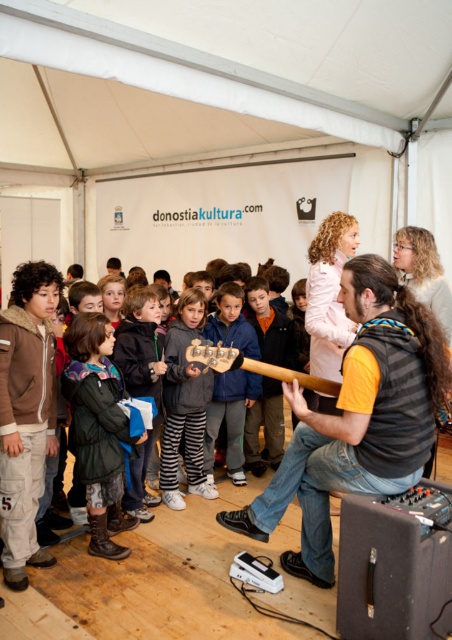
Question: Can you confirm if blue fabric jacket at center is positioned to the left of wooden guitar at center?

Choices:
 (A) yes
 (B) no

Answer: (A)

Question: Which is nearer to the wooden guitar at center?

Choices:
 (A) gray fleece jacket at center
 (B) blue fabric jacket at center

Answer: (A)

Question: Does dark green jacket at center lie behind blue fabric jacket at center?

Choices:
 (A) no
 (B) yes

Answer: (A)

Question: Which of the following is the closest to the observer?

Choices:
 (A) wooden guitar at center
 (B) dark green jacket at center
 (C) gray fleece jacket at center
 (D) blue fabric jacket at center

Answer: (A)

Question: Which point is closer to the camera?

Choices:
 (A) (112, 397)
 (B) (249, 364)
 (C) (164, 452)

Answer: (B)

Question: Is dark green jacket at center behind blue fabric jacket at center?

Choices:
 (A) yes
 (B) no

Answer: (B)